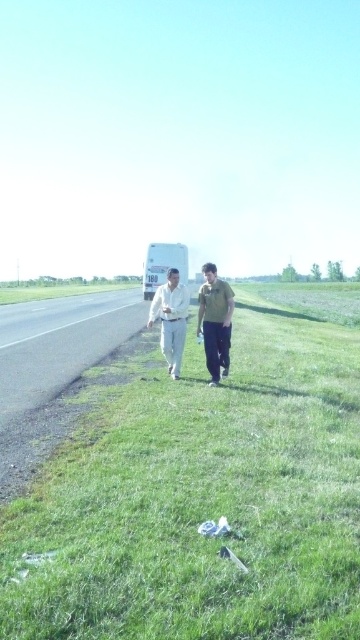
You are standing at the point closest to the white bus with the number 180. Which point, point (x=280, y=300) or point (x=223, y=348), is farther away from you?

Point (x=280, y=300) is farther away from you because it is behind point (x=223, y=348).

You are a gardener who needs to mow the lawn. You see the green grass at center and the asphalt road at left. Which area requires mowing?

The green grass at center requires mowing because it is taller than the asphalt road at left, indicating it needs trimming.